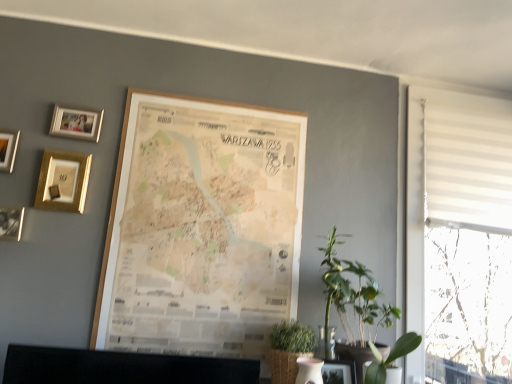
Question: Can you confirm if green leafy plant at lower right, positioned as the 1th plant in right-to-left order, is positioned to the left of white textured blinds at right?

Choices:
 (A) no
 (B) yes

Answer: (B)

Question: Are green leafy plant at lower right, which ranks as the second plant in left-to-right order, and white textured blinds at right beside each other?

Choices:
 (A) yes
 (B) no

Answer: (B)

Question: Can we say green leafy plant at lower right, positioned as the 1th plant in right-to-left order, lies outside white textured blinds at right?

Choices:
 (A) no
 (B) yes

Answer: (B)

Question: Would you say white textured blinds at right is part of green leafy plant at lower right, positioned as the 1th plant in right-to-left order,'s contents?

Choices:
 (A) yes
 (B) no

Answer: (B)

Question: Can you confirm if green leafy plant at lower right, positioned as the 1th plant in right-to-left order, is shorter than white textured blinds at right?

Choices:
 (A) no
 (B) yes

Answer: (B)

Question: Does green leafy plant at lower right, positioned as the 1th plant in right-to-left order, have a smaller size compared to white textured blinds at right?

Choices:
 (A) no
 (B) yes

Answer: (B)

Question: Is green leafy plant at right, placed as the 2th plant when sorted from right to left, oriented towards white textured blinds at right?

Choices:
 (A) yes
 (B) no

Answer: (B)

Question: Does green leafy plant at right, the first plant viewed from the left, have a lesser height compared to white textured blinds at right?

Choices:
 (A) yes
 (B) no

Answer: (A)

Question: Is green leafy plant at right, the first plant viewed from the left, outside of white textured blinds at right?

Choices:
 (A) no
 (B) yes

Answer: (B)

Question: From a real-world perspective, is green leafy plant at right, the first plant viewed from the left, positioned under white textured blinds at right based on gravity?

Choices:
 (A) yes
 (B) no

Answer: (A)

Question: Can you confirm if green leafy plant at right, placed as the 2th plant when sorted from right to left, is positioned to the left of white textured blinds at right?

Choices:
 (A) yes
 (B) no

Answer: (A)

Question: From a real-world perspective, is green leafy plant at right, placed as the 2th plant when sorted from right to left, over white textured blinds at right?

Choices:
 (A) yes
 (B) no

Answer: (B)

Question: Does matte gold picture frame at upper left, which ranks as the 5th picture frame in right-to-left order, have a lesser height compared to wooden photo frame at upper left, marked as the first picture frame in a left-to-right arrangement?

Choices:
 (A) no
 (B) yes

Answer: (B)